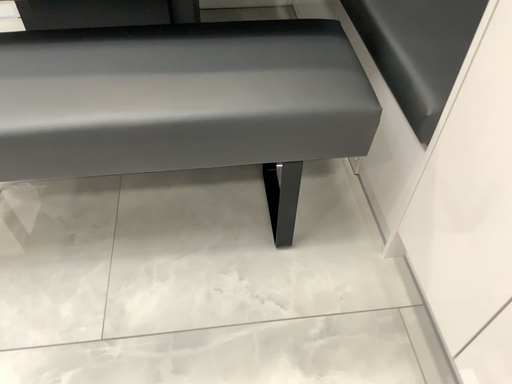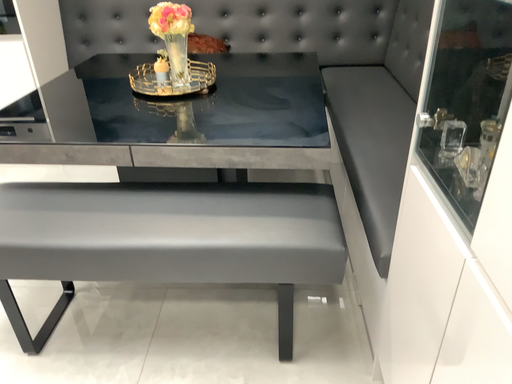
Question: Which way did the camera rotate in the video?

Choices:
 (A) rotated right
 (B) rotated left

Answer: (B)